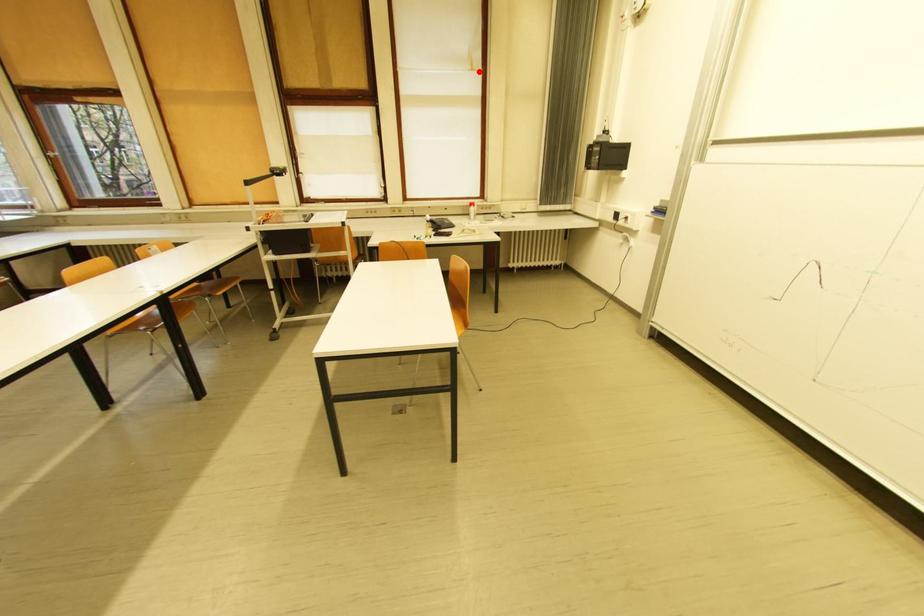
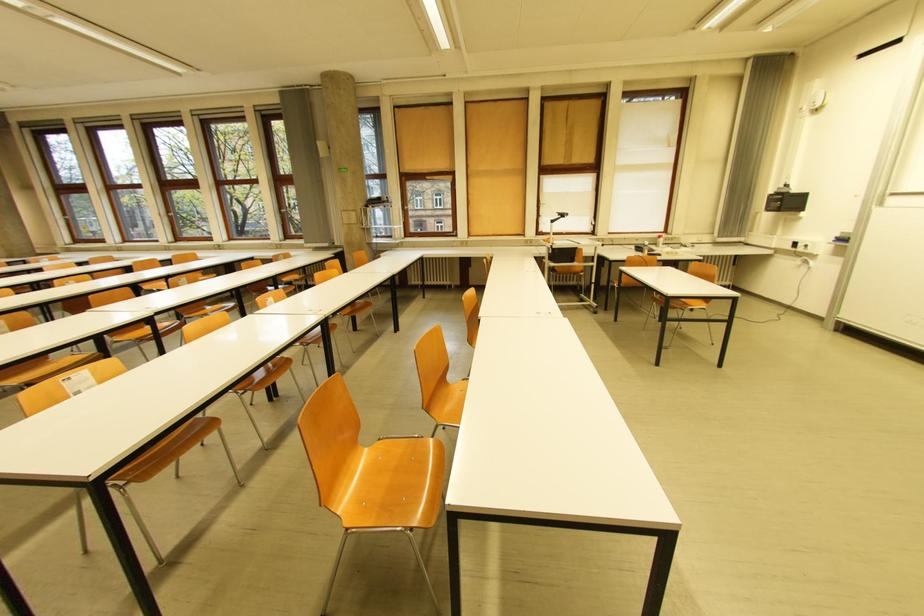
Find the pixel in the second image that matches the highlighted location in the first image.

(676, 148)